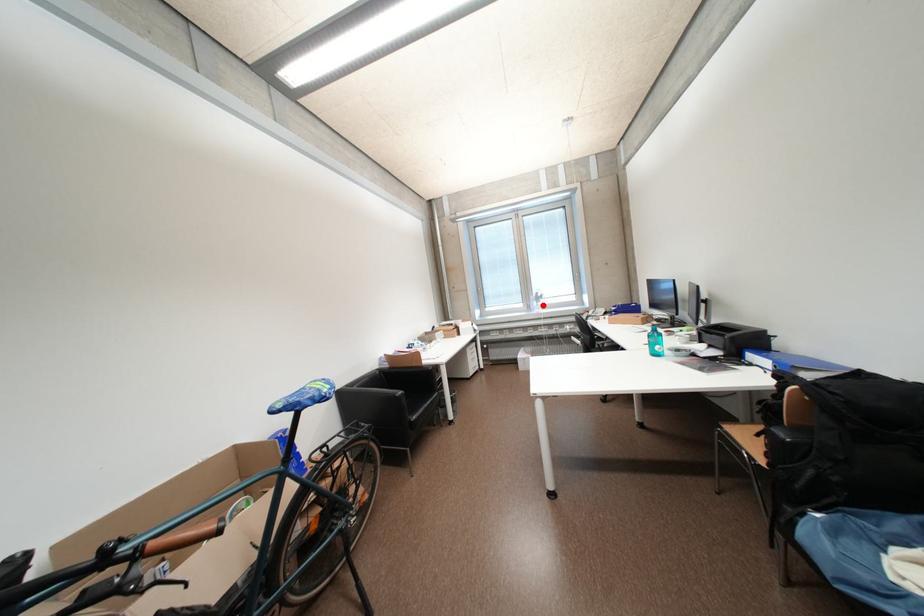
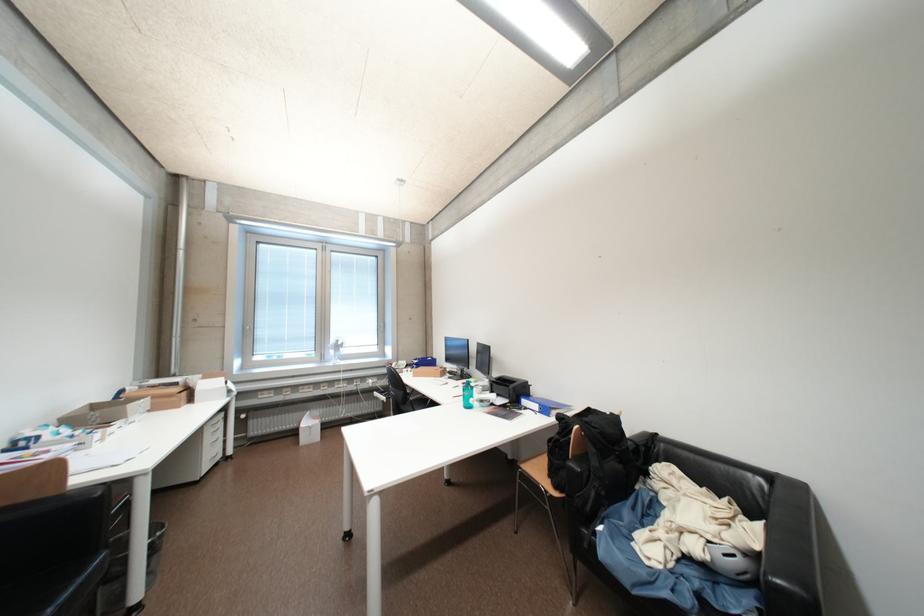
Question: I am providing you with two images of the same scene from different viewpoints. Given a red point in image1, look at the same physical point in image2. Is it:

Choices:
 (A) Closer to the viewpoint
 (B) Farther from the viewpoint

Answer: (B)